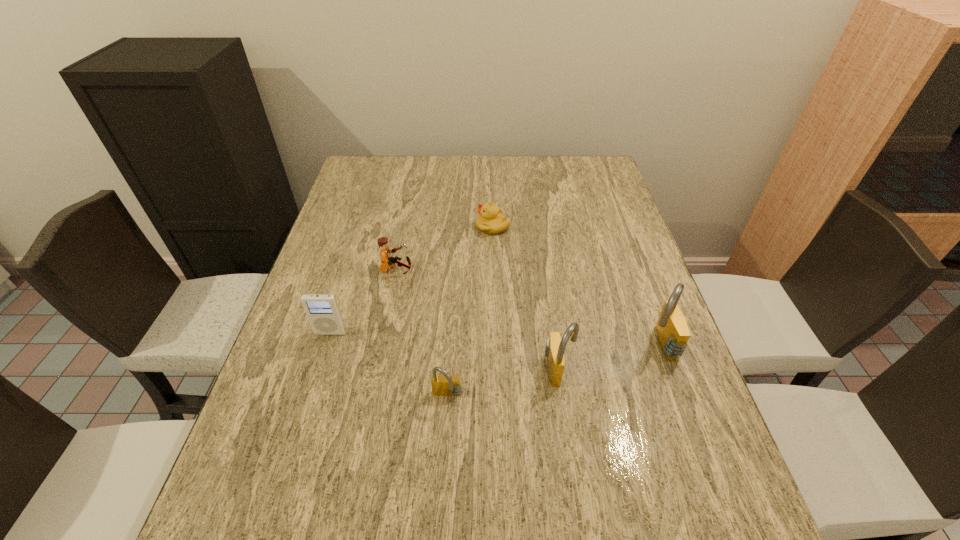
Find the location of a particular element. Image resolution: width=960 pixels, height=540 pixels. vacant space situated holding a crossbow in the hands of the Lego is located at coordinates (458, 271).

Identify the location of object at the left edge. (322, 310).

Identify the location of object present at the right edge. This screenshot has width=960, height=540. (673, 334).

Find the location of a particular element. vacant area at the far edge is located at coordinates (404, 168).

Locate an element on the screen. This screenshot has height=540, width=960. free space at the near edge of the desktop is located at coordinates (507, 480).

In the image, there is a desktop. Identify the location of vacant region at the left edge. (291, 350).

The width and height of the screenshot is (960, 540). I want to click on vacant region at the right edge of the desktop, so click(x=594, y=282).

Where is `free space at the far left corner`? free space at the far left corner is located at coordinates (371, 193).

In the image, there is a desktop. Find the location of `vacant area at the near left corner`. vacant area at the near left corner is located at coordinates (251, 461).

Where is `vacant region at the far right corner of the desktop`? The width and height of the screenshot is (960, 540). vacant region at the far right corner of the desktop is located at coordinates (588, 167).